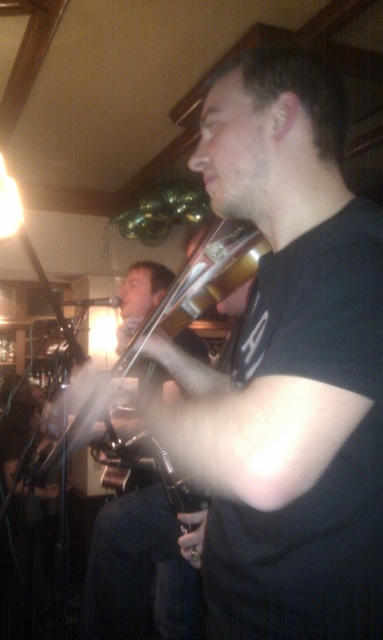
Is shiny silver cello at center below shiny silver violin at center?

Yes.

Does shiny silver cello at center appear on the left side of shiny silver violin at center?

Incorrect, shiny silver cello at center is not on the left side of shiny silver violin at center.

Find the location of a particular element. This screenshot has width=383, height=640. shiny silver cello at center is located at coordinates click(x=140, y=570).